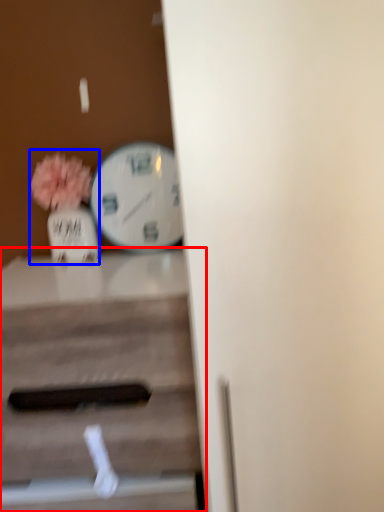
Question: Which of the following is the closest to the observer, table (highlighted by a red box) or floral arrangement (highlighted by a blue box)?

Choices:
 (A) table
 (B) floral arrangement

Answer: (A)